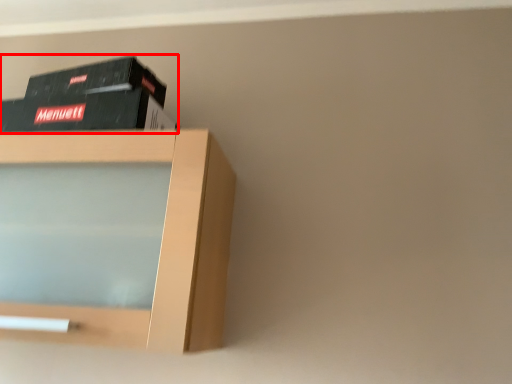
Question: From the image, what is the correct spatial relationship of book (annotated by the red box) in relation to shelf?

Choices:
 (A) right
 (B) left

Answer: (A)